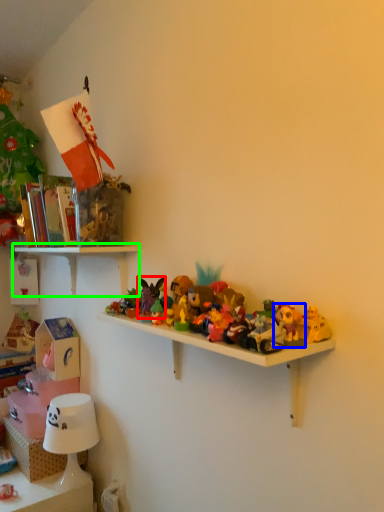
Question: Based on their relative distances, which object is nearer to toy (highlighted by a red box)? Choose from toy (highlighted by a blue box) and shelf (highlighted by a green box).

Choices:
 (A) toy
 (B) shelf

Answer: (B)